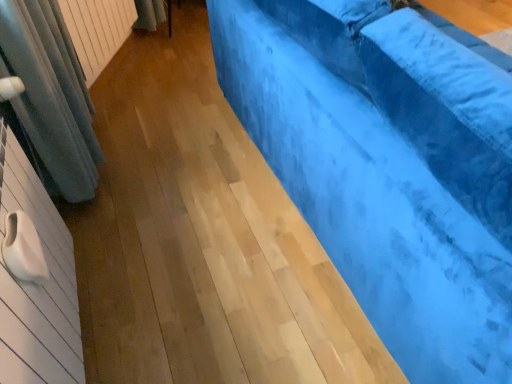
Question: Should I look upward or downward to see white textured radiator at upper left?

Choices:
 (A) down
 (B) up

Answer: (B)

Question: Is the depth of velvet blue couch at right greater than that of white textured radiator at upper left?

Choices:
 (A) yes
 (B) no

Answer: (B)

Question: Is velvet blue couch at right facing towards white textured radiator at upper left?

Choices:
 (A) yes
 (B) no

Answer: (B)

Question: Can you confirm if velvet blue couch at right is wider than white textured radiator at upper left?

Choices:
 (A) no
 (B) yes

Answer: (B)

Question: Can you confirm if velvet blue couch at right is thinner than white textured radiator at upper left?

Choices:
 (A) no
 (B) yes

Answer: (A)

Question: Is velvet blue couch at right turned away from white textured radiator at upper left?

Choices:
 (A) no
 (B) yes

Answer: (A)

Question: From the image's perspective, is velvet blue couch at right on white textured radiator at upper left?

Choices:
 (A) yes
 (B) no

Answer: (B)

Question: Can you confirm if white textured radiator at upper left is positioned to the right of velvet blue couch at right?

Choices:
 (A) yes
 (B) no

Answer: (B)

Question: Does white textured radiator at upper left come behind velvet blue couch at right?

Choices:
 (A) no
 (B) yes

Answer: (B)

Question: Considering the relative sizes of white textured radiator at upper left and velvet blue couch at right in the image provided, is white textured radiator at upper left taller than velvet blue couch at right?

Choices:
 (A) yes
 (B) no

Answer: (B)

Question: From a real-world perspective, is white textured radiator at upper left physically below velvet blue couch at right?

Choices:
 (A) no
 (B) yes

Answer: (B)

Question: Is white textured radiator at upper left thinner than velvet blue couch at right?

Choices:
 (A) yes
 (B) no

Answer: (A)

Question: Would you say velvet blue couch at right is part of white textured radiator at upper left's contents?

Choices:
 (A) no
 (B) yes

Answer: (A)

Question: From a real-world perspective, is white textured radiator at upper left above or below velvet blue couch at right?

Choices:
 (A) above
 (B) below

Answer: (B)